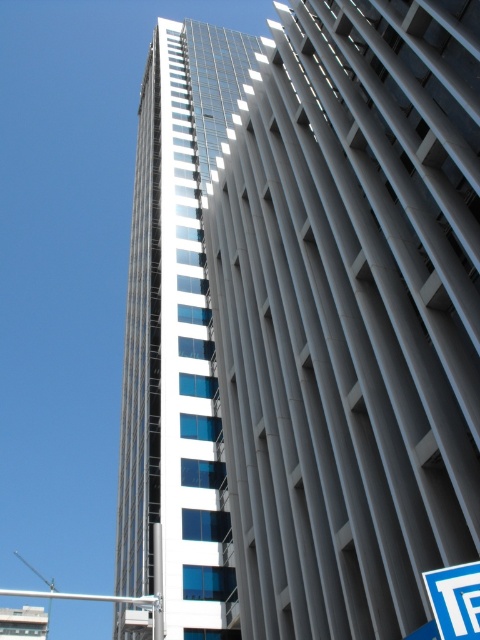
Question: Does smooth glass building at center have a larger size compared to blue plastic street sign at lower right?

Choices:
 (A) no
 (B) yes

Answer: (B)

Question: Which point appears closest to the camera in this image?

Choices:
 (A) (310, 253)
 (B) (188, 412)
 (C) (155, 605)

Answer: (C)

Question: Which of the following is the farthest from the observer?

Choices:
 (A) (465, 636)
 (B) (152, 598)
 (C) (398, 129)

Answer: (C)

Question: Does smooth glass building at center have a smaller size compared to silver metallic pole at center?

Choices:
 (A) yes
 (B) no

Answer: (A)

Question: Does glassy reflective building at center come in front of silver metallic pole at center?

Choices:
 (A) yes
 (B) no

Answer: (B)

Question: Which of the following is the closest to the observer?

Choices:
 (A) smooth glass building at center
 (B) glassy reflective building at center
 (C) silver metallic pole at center
 (D) blue plastic street sign at lower right

Answer: (D)